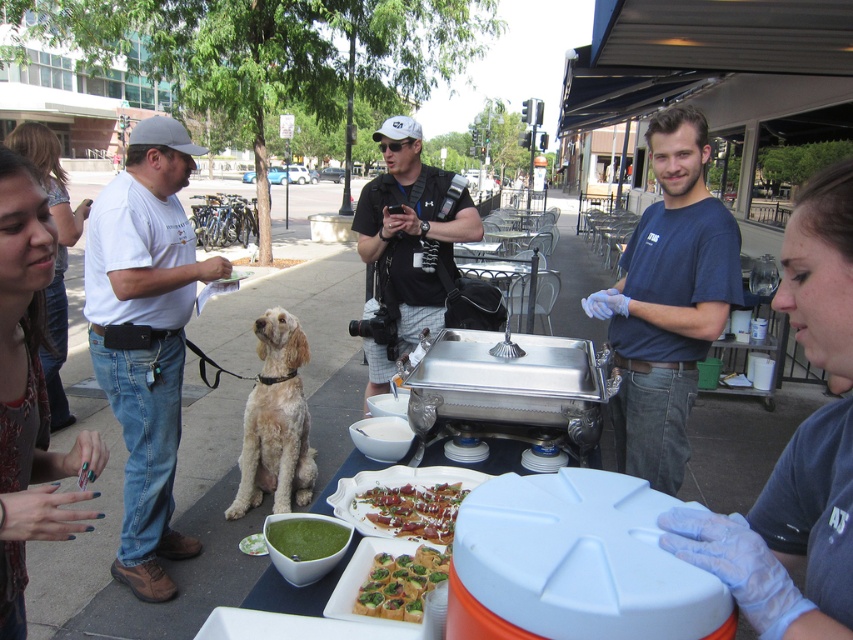
Question: Is blue cotton shirt at center smaller than green leafymaterial/textureappetizer at center?

Choices:
 (A) yes
 (B) no

Answer: (B)

Question: Which object is positioned closest to the blue cotton shirt at center?

Choices:
 (A) green painted nails at lower left
 (B) black mesh vest at center
 (C) fuzzy beige dog at center

Answer: (B)

Question: Which is nearer to the green leafymaterial/textureappetizer at center?

Choices:
 (A) white cotton shirt at left
 (B) green painted nails at lower left

Answer: (B)

Question: Does fuzzy beige dog at center have a greater width compared to matte black shirt at upper left?

Choices:
 (A) no
 (B) yes

Answer: (A)

Question: Which of the following is the farthest from the observer?

Choices:
 (A) (375, 616)
 (B) (624, 320)

Answer: (B)

Question: Does matte black shirt at upper left appear on the left side of green leafymaterial/textureappetizer at center?

Choices:
 (A) yes
 (B) no

Answer: (A)